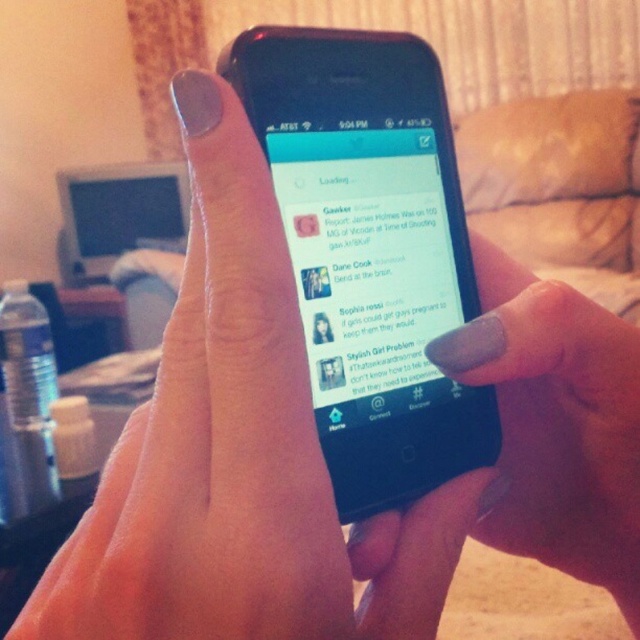
Question: Which is nearer to the black glossy smartphone at center?

Choices:
 (A) nail polish at center
 (B) matte black phone at center
 (C) matte gray nail polish at center

Answer: (B)

Question: Can you confirm if black glossy smartphone at center is bigger than matte gray nail polish at center?

Choices:
 (A) yes
 (B) no

Answer: (A)

Question: Can you confirm if nail polish at center is positioned below matte black phone at center?

Choices:
 (A) no
 (B) yes

Answer: (B)

Question: Which of these objects is positioned farthest from the nail polish at center?

Choices:
 (A) matte gray nail polish at center
 (B) black glossy smartphone at center

Answer: (A)

Question: Does black glossy smartphone at center lie behind matte black phone at center?

Choices:
 (A) yes
 (B) no

Answer: (B)

Question: Which point is farther from the camera taking this photo?

Choices:
 (A) (563, 340)
 (B) (225, 172)
 (C) (340, 45)

Answer: (C)